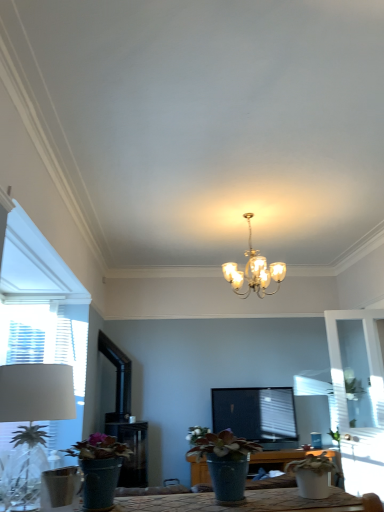
Question: From a real-world perspective, is white matte flower at center located beneath white fabric lampshade at left?

Choices:
 (A) no
 (B) yes

Answer: (B)

Question: Considering the relative sizes of white matte flower at center and white fabric lampshade at left in the image provided, is white matte flower at center bigger than white fabric lampshade at left?

Choices:
 (A) yes
 (B) no

Answer: (B)

Question: From the image's perspective, is white matte flower at center on top of white fabric lampshade at left?

Choices:
 (A) no
 (B) yes

Answer: (A)

Question: Is white matte flower at center far away from white fabric lampshade at left?

Choices:
 (A) no
 (B) yes

Answer: (A)

Question: From the image's perspective, is white matte flower at center below white fabric lampshade at left?

Choices:
 (A) yes
 (B) no

Answer: (A)

Question: Is white matte flower at center beside white fabric lampshade at left?

Choices:
 (A) no
 (B) yes

Answer: (A)

Question: From a real-world perspective, is gold metallic chandelier at center under white matte flower at center?

Choices:
 (A) no
 (B) yes

Answer: (A)

Question: Considering the relative sizes of gold metallic chandelier at center and white matte flower at center in the image provided, is gold metallic chandelier at center bigger than white matte flower at center?

Choices:
 (A) yes
 (B) no

Answer: (A)

Question: Is gold metallic chandelier at center positioned behind white matte flower at center?

Choices:
 (A) yes
 (B) no

Answer: (B)

Question: Is white matte flower at center at the back of gold metallic chandelier at center?

Choices:
 (A) no
 (B) yes

Answer: (A)

Question: Considering the relative sizes of gold metallic chandelier at center and white matte flower at center in the image provided, is gold metallic chandelier at center thinner than white matte flower at center?

Choices:
 (A) no
 (B) yes

Answer: (A)

Question: Is gold metallic chandelier at center aimed at white matte flower at center?

Choices:
 (A) yes
 (B) no

Answer: (B)

Question: Is white fabric lampshade at left behind white matte flower at center?

Choices:
 (A) no
 (B) yes

Answer: (A)